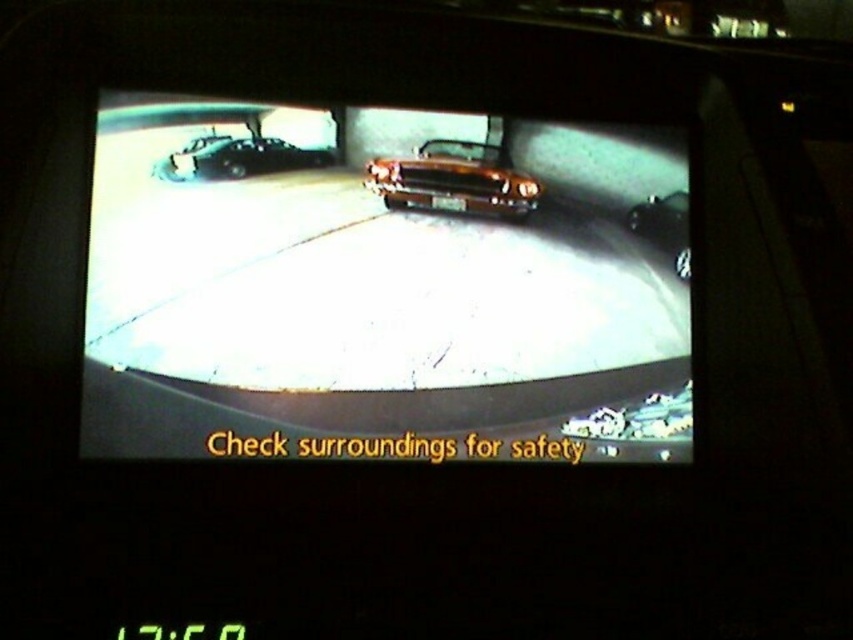
Between shiny chrome car at center and shiny brown car at center, which one has less height?

shiny brown car at center is shorter.

Can you confirm if shiny chrome car at center is positioned to the right of shiny brown car at center?

Incorrect, shiny chrome car at center is not on the right side of shiny brown car at center.

This screenshot has height=640, width=853. I want to click on shiny chrome car at center, so click(384, 291).

Describe the element at coordinates (453, 180) in the screenshot. This screenshot has width=853, height=640. I see `shiny brown car at center` at that location.

Describe the element at coordinates (453, 180) in the screenshot. Image resolution: width=853 pixels, height=640 pixels. I see `shiny brown car at center` at that location.

You are a GUI agent. You are given a task and a screenshot of the screen. Output one action in this format:
    pyautogui.click(x=<x>, y=<y>)
    Task: Click on the shiny brown car at center
    The image size is (853, 640).
    Given the screenshot: What is the action you would take?
    pyautogui.click(x=453, y=180)

Does shiny brown car at center appear under shiny black car at left?

Yes.

Which is in front, point (479, 173) or point (233, 168)?

Point (233, 168) is more forward.

Where is `shiny brown car at center`? shiny brown car at center is located at coordinates (453, 180).